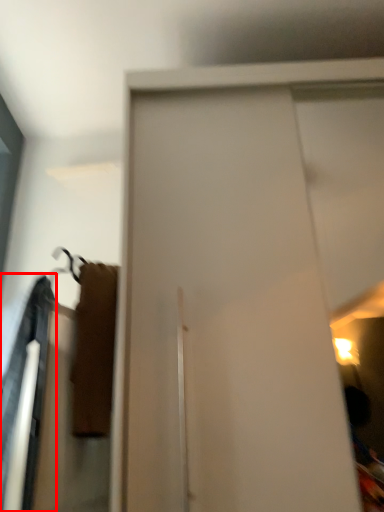
Question: From the image's perspective, where is robe (annotated by the red box) located relative to screen door?

Choices:
 (A) above
 (B) below

Answer: (B)